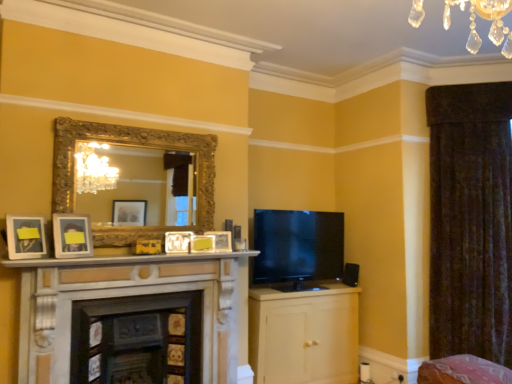
Question: Is black glossy flat-screen tv at center-right completely or partially outside of matte white picture frame at center, placed as the third picture frame when sorted from right to left?

Choices:
 (A) yes
 (B) no

Answer: (A)

Question: From the image's perspective, is black glossy flat-screen tv at center-right on matte white picture frame at center, the 4th picture frame in the left-to-right sequence?

Choices:
 (A) no
 (B) yes

Answer: (A)

Question: Is black glossy flat-screen tv at center-right looking in the opposite direction of matte white picture frame at center, the 4th picture frame in the left-to-right sequence?

Choices:
 (A) yes
 (B) no

Answer: (B)

Question: Is black glossy flat-screen tv at center-right positioned far away from matte white picture frame at center, placed as the third picture frame when sorted from right to left?

Choices:
 (A) yes
 (B) no

Answer: (A)

Question: Does black glossy flat-screen tv at center-right have a lesser width compared to matte white picture frame at center, placed as the third picture frame when sorted from right to left?

Choices:
 (A) no
 (B) yes

Answer: (A)

Question: Considering the relative positions of black glossy flat-screen tv at center-right and matte white picture frame at center, the 4th picture frame in the left-to-right sequence, in the image provided, is black glossy flat-screen tv at center-right to the left of matte white picture frame at center, the 4th picture frame in the left-to-right sequence, from the viewer's perspective?

Choices:
 (A) yes
 (B) no

Answer: (B)

Question: Is pink fabric swivel chair at lower right positioned behind wooden fireplace at lower center, acting as the first fireplace starting from the left?

Choices:
 (A) no
 (B) yes

Answer: (A)

Question: Is wooden fireplace at lower center, acting as the first fireplace starting from the left, completely or partially inside pink fabric swivel chair at lower right?

Choices:
 (A) no
 (B) yes

Answer: (A)

Question: From the image's perspective, does pink fabric swivel chair at lower right appear higher than wooden fireplace at lower center, the 2th fireplace from the right?

Choices:
 (A) no
 (B) yes

Answer: (A)

Question: Considering the relative sizes of pink fabric swivel chair at lower right and wooden fireplace at lower center, the 2th fireplace from the right, in the image provided, is pink fabric swivel chair at lower right bigger than wooden fireplace at lower center, the 2th fireplace from the right,?

Choices:
 (A) yes
 (B) no

Answer: (A)

Question: Can you confirm if pink fabric swivel chair at lower right is taller than wooden fireplace at lower center, acting as the first fireplace starting from the left?

Choices:
 (A) no
 (B) yes

Answer: (A)

Question: From a real-world perspective, is pink fabric swivel chair at lower right located higher than wooden fireplace at lower center, acting as the first fireplace starting from the left?

Choices:
 (A) yes
 (B) no

Answer: (B)

Question: From the image's perspective, does black glossy flat-screen tv at center-right appear lower than matte yellow picture frame at center, the second picture frame in the right-to-left sequence?

Choices:
 (A) yes
 (B) no

Answer: (A)